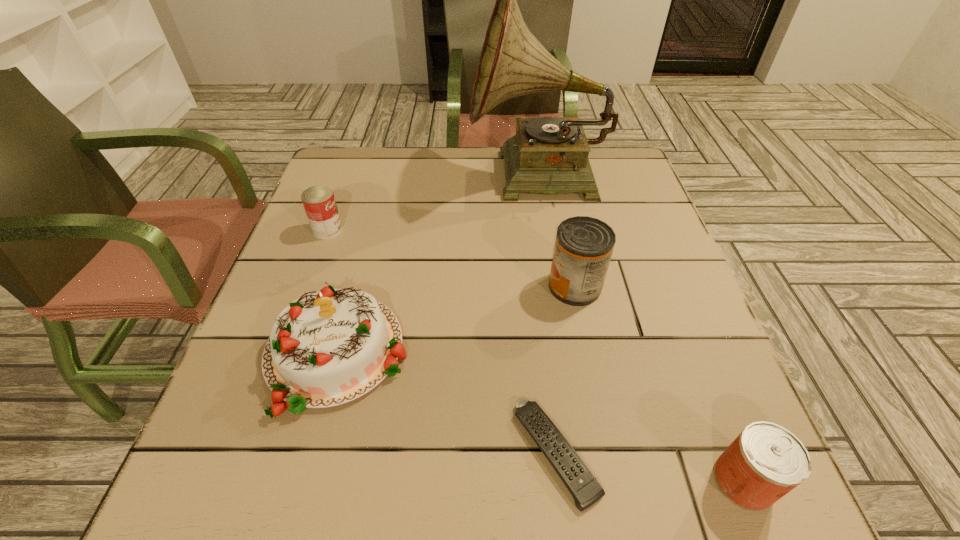
Where is `record player`? The width and height of the screenshot is (960, 540). record player is located at coordinates (549, 155).

Locate an element on the screen. The image size is (960, 540). the tallest object is located at coordinates (549, 155).

You are a GUI agent. You are given a task and a screenshot of the screen. Output one action in this format:
    pyautogui.click(x=<x>, y=<y>)
    Task: Click on the second can from left to right
    Image resolution: width=960 pixels, height=540 pixels.
    Given the screenshot: What is the action you would take?
    pyautogui.click(x=584, y=245)

Where is `the second nearest can`? The width and height of the screenshot is (960, 540). the second nearest can is located at coordinates (584, 245).

What are the coordinates of `cake` in the screenshot? It's located at (326, 348).

Where is `the second farthest object`? the second farthest object is located at coordinates (319, 203).

Where is `the farthest can`? Image resolution: width=960 pixels, height=540 pixels. the farthest can is located at coordinates (319, 203).

You are a GUI agent. You are given a task and a screenshot of the screen. Output one action in this format:
    pyautogui.click(x=<x>, y=<y>)
    Task: Click on the rightmost object
    The image size is (960, 540).
    Given the screenshot: What is the action you would take?
    pyautogui.click(x=766, y=461)

At what (x,y) coordinates should I click in order to perform the action: click on the rightmost can. Please return your answer as a coordinate pair (x, y). Image resolution: width=960 pixels, height=540 pixels. Looking at the image, I should click on (766, 461).

Locate an element on the screen. This screenshot has width=960, height=540. the shortest object is located at coordinates (585, 489).